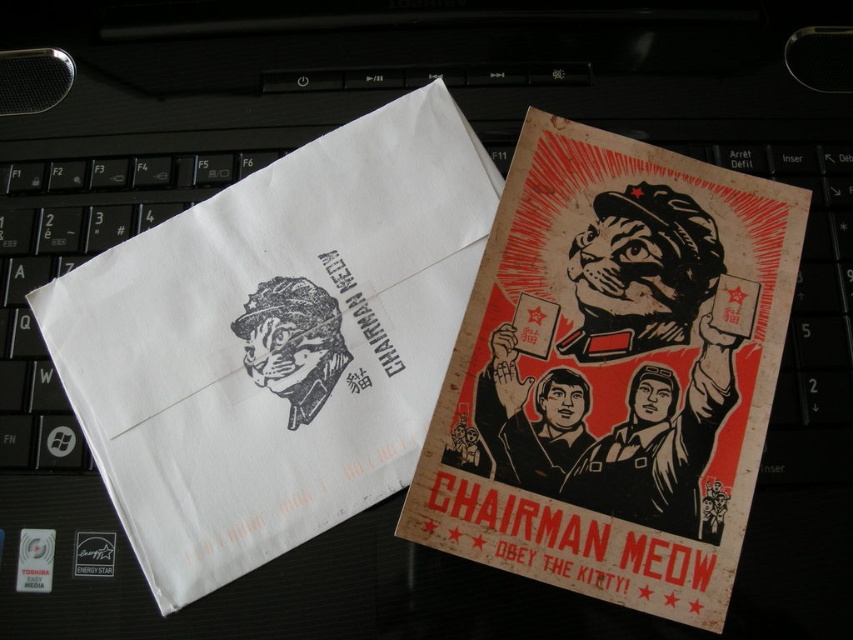
In the scene shown: You are organizing a desk and need to place a new item between the white paper envelope at upper left and the wooden poster at center. Based on their positions, where should you place the new item?

The white paper envelope at upper left is located above the wooden poster at center, so you should place the new item between them by positioning it below the white paper envelope at upper left and above the wooden poster at center.

You are organizing a desk and need to move items from the keyboard. Which item, the white paper envelope at upper left or the wooden poster at center, is closer to you so you can pick it up first?

The white paper envelope at upper left is closer to you than the wooden poster at center, so you can pick it up first.

You are organizing a desk and need to place both the white paper envelope at upper left and the wooden poster at center into a drawer. The drawer has a width of 15 cm. Which item will not fit if placed individually?

The white paper envelope at upper left has a larger width than the wooden poster at center, so the white paper envelope at upper left will not fit in the drawer individually.